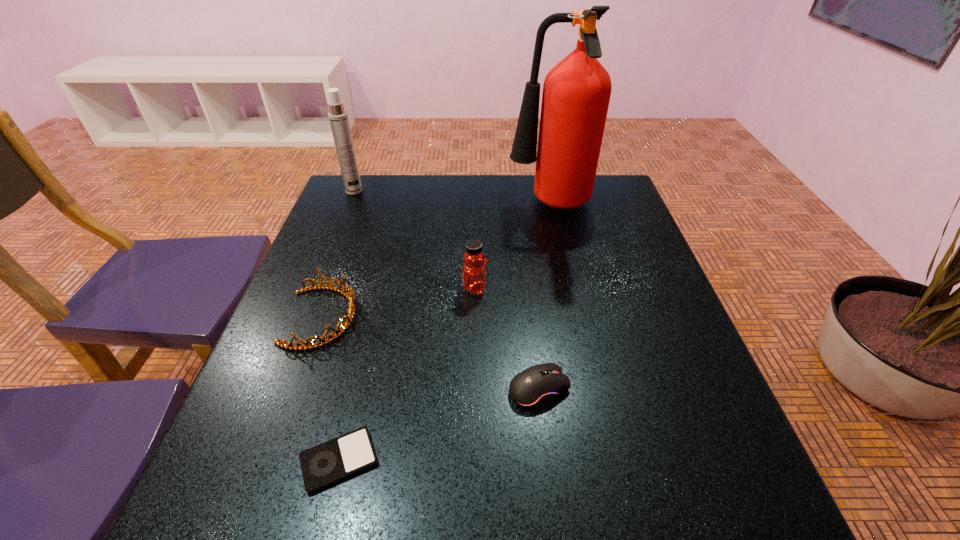
You are a GUI agent. You are given a task and a screenshot of the screen. Output one action in this format:
    pyautogui.click(x=<x>, y=<y>)
    Task: Click on the aerosol can that is positioned at the left edge
    Image resolution: width=960 pixels, height=540 pixels.
    Given the screenshot: What is the action you would take?
    pyautogui.click(x=338, y=117)

Find the location of a particular element. Image resolution: width=960 pixels, height=540 pixels. tiara that is at the left edge is located at coordinates (350, 296).

Locate an element on the screen. The width and height of the screenshot is (960, 540). iPod located in the left edge section of the desktop is located at coordinates (332, 461).

The width and height of the screenshot is (960, 540). In order to click on object that is at the right edge in this screenshot , I will do `click(576, 93)`.

The image size is (960, 540). I want to click on object that is at the far left corner, so click(338, 117).

Find the location of a particular element. The width and height of the screenshot is (960, 540). object that is at the near left corner is located at coordinates (332, 461).

Find the location of `object at the far right corner`. object at the far right corner is located at coordinates (576, 93).

Identify the location of vacant region at the far edge of the desktop. (435, 218).

You are a GUI agent. You are given a task and a screenshot of the screen. Output one action in this format:
    pyautogui.click(x=<x>, y=<y>)
    Task: Click on the vacant space at the right edge
    Image resolution: width=960 pixels, height=540 pixels.
    Given the screenshot: What is the action you would take?
    pyautogui.click(x=672, y=395)

In the image, there is a desktop. Identify the location of free space at the far right corner. (586, 212).